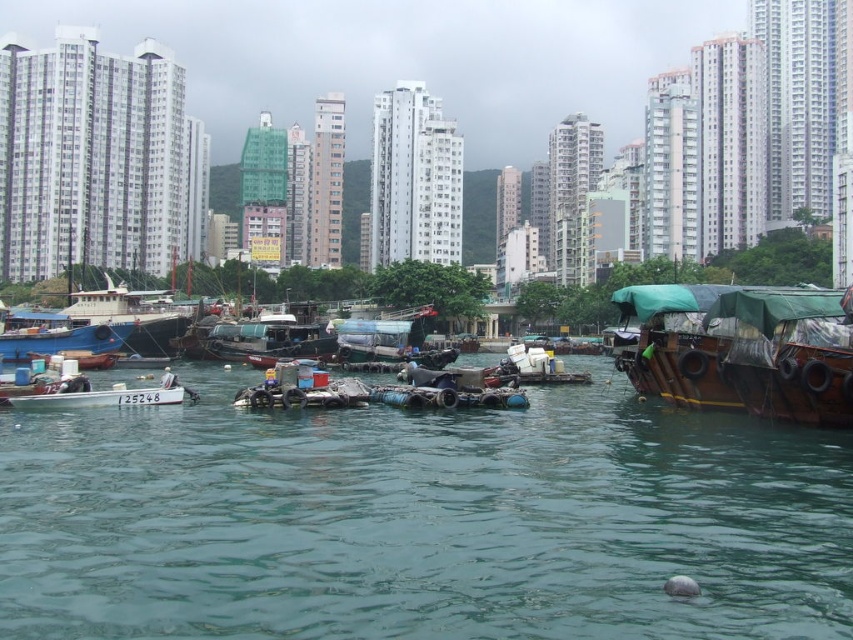
You are a delivery person needing to transport a package from the green canvas boat at right to the white matte boat at left. Given that your boat can only carry items up to 35 meters in length, can you safely make this journey?

The distance between the green canvas boat at right and the white matte boat at left is 36.92 meters. Since your boat can only carry items up to 35 meters in length, you cannot safely make this journey as the distance exceeds the capacity.

You are standing at the waterfront and want to take a photo of the green canvas boat at right. If your camera has a maximum zoom range of 50 meters, will you be able to capture the boat clearly without moving closer?

The green canvas boat at right is 47.30 meters away from the camera. Since the camera can zoom up to 50 meters, you can capture the boat clearly without moving closer.

You are a delivery person needing to transport a large package that requires a minimum of 200 feet of space between two boats to safely pass through. Based on the scene described, can you safely navigate between the green canvas boat at right and the blue matte boat at left?

The distance between the green canvas boat at right and the blue matte boat at left is 189.78 feet, which is less than the required 200 feet. Therefore, you cannot safely navigate the large package through this space.